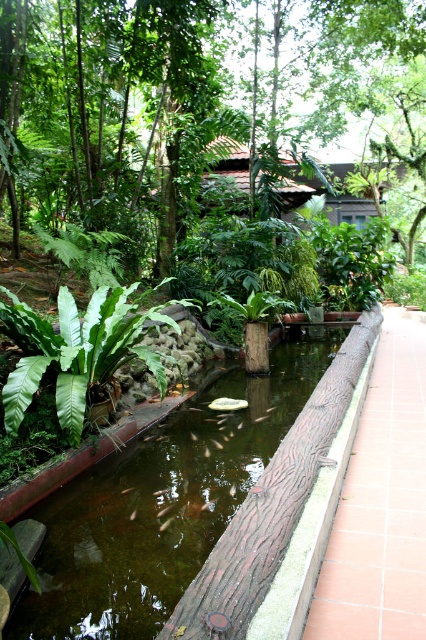
Is point (181, 172) farther from camera compared to point (74, 330)?

That is True.

Is point (310, 13) less distant than point (28, 328)?

No, it is not.

What are the coordinates of `green leafy tree at center` in the screenshot? It's located at (172, 99).

Does clear water at pond center have a lesser height compared to green leafy fern at center-left?

Yes.

Find the location of `clear water at pond center`. clear water at pond center is located at coordinates (161, 506).

At what (x,y) coordinates should I click in order to perform the action: click on clear water at pond center. Please return your answer as a coordinate pair (x, y). The image size is (426, 640). Looking at the image, I should click on (161, 506).

Between clear water at pond center and brown textured path at right, which one is positioned lower?

Positioned lower is clear water at pond center.

Looking at this image, which is more to the right, clear water at pond center or brown textured path at right?

brown textured path at right is more to the right.

Where is `clear water at pond center`? The height and width of the screenshot is (640, 426). clear water at pond center is located at coordinates coord(161,506).